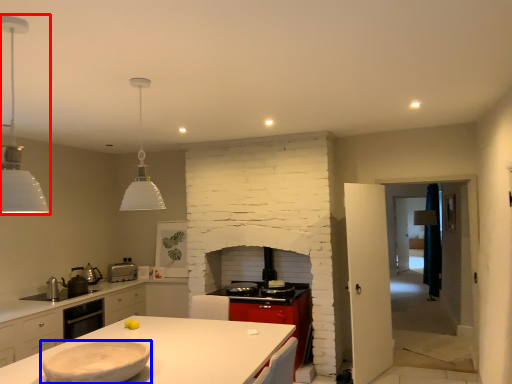
Question: Which of the following is the closest to the observer, light fixture (highlighted by a red box) or tableware (highlighted by a blue box)?

Choices:
 (A) light fixture
 (B) tableware

Answer: (A)